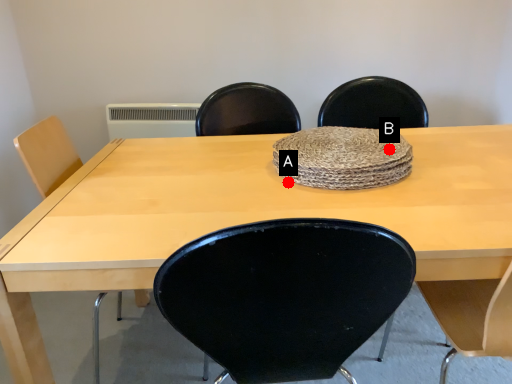
Question: Two points are circled on the image, labeled by A and B beside each circle. Which point is farther to the camera?

Choices:
 (A) A is further
 (B) B is further

Answer: (B)